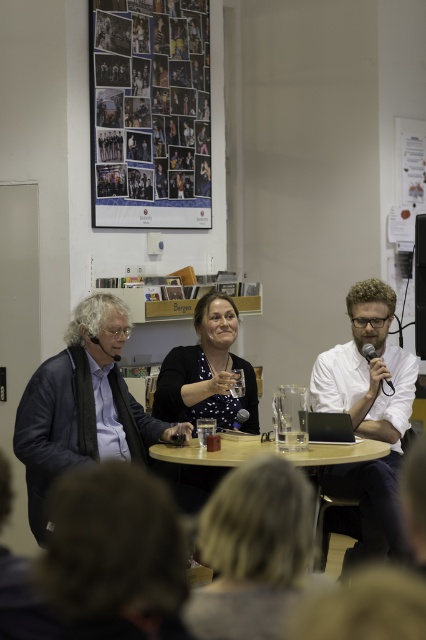
Question: Which of the following is the farthest from the observer?

Choices:
 (A) polka dot blouse at center
 (B) dark blue suit at left

Answer: (A)

Question: Which object is closer to the camera taking this photo?

Choices:
 (A) polka dot blouse at center
 (B) black matte laptop at center
 (C) white matte shirt at center

Answer: (C)

Question: Can you confirm if matte paper collage at upper left is smaller than black matte laptop at center?

Choices:
 (A) yes
 (B) no

Answer: (B)

Question: Which object is farther from the camera taking this photo?

Choices:
 (A) white matte shirt at center
 (B) black matte laptop at center
 (C) matte paper collage at upper left
 (D) dark blue suit at left

Answer: (C)

Question: Is matte paper collage at upper left above black matte laptop at center?

Choices:
 (A) yes
 (B) no

Answer: (A)

Question: Does matte paper collage at upper left have a smaller size compared to white matte shirt at center?

Choices:
 (A) yes
 (B) no

Answer: (B)